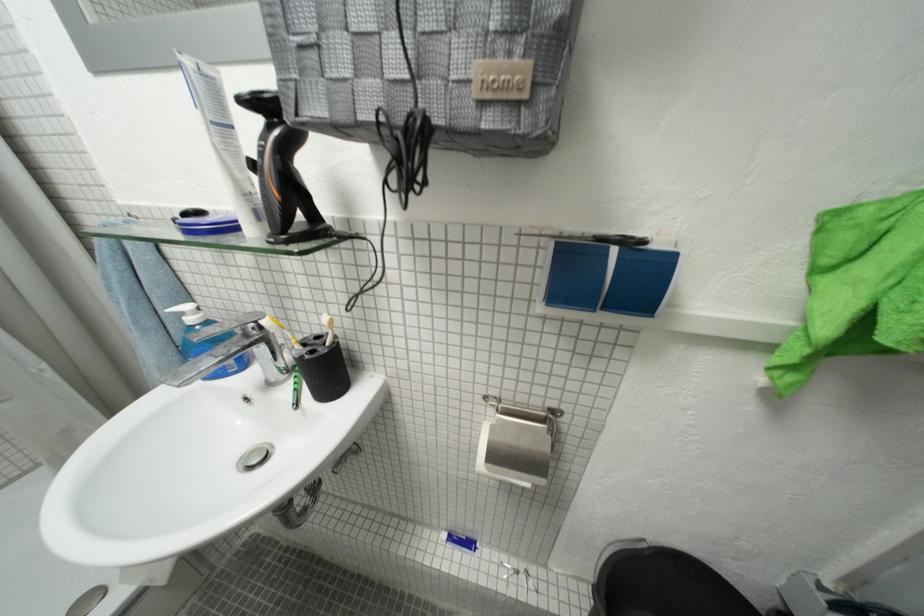
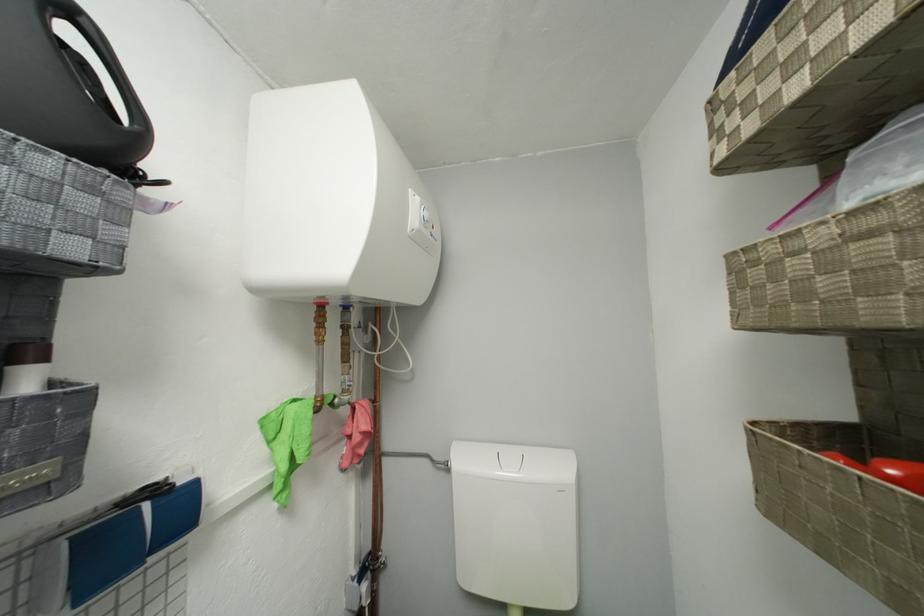
Where in the second image is the point corresponding to the point at 535,98 from the first image?

(66, 477)